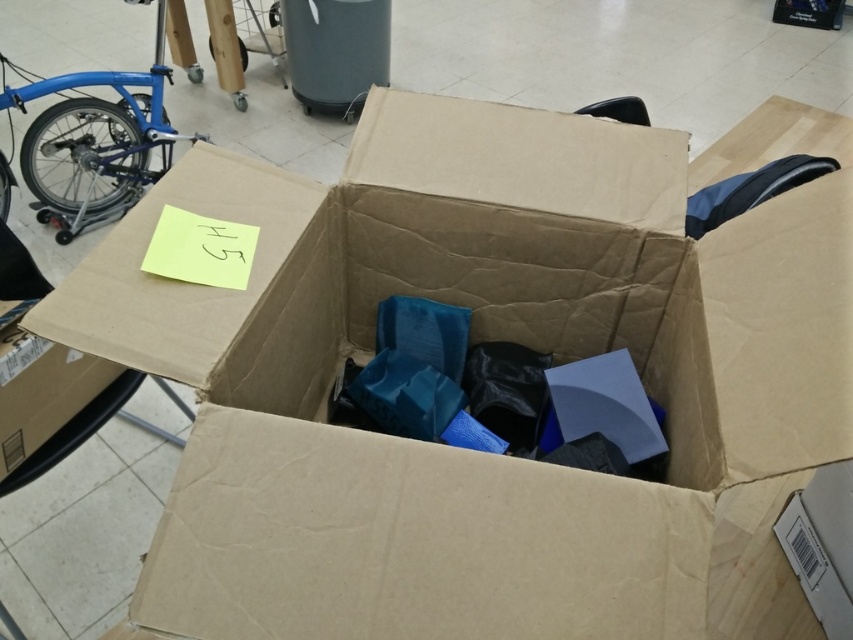
You are a GUI agent. You are given a task and a screenshot of the screen. Output one action in this format:
    pyautogui.click(x=<x>, y=<y>)
    Task: Click on the matte blue bicycle at left
    This screenshot has width=853, height=640.
    Given the screenshot: What is the action you would take?
    pyautogui.click(x=96, y=141)

Between point (106, 184) and point (55, 358), which one is positioned behind?

Positioned behind is point (106, 184).

You are a GUI agent. You are given a task and a screenshot of the screen. Output one action in this format:
    pyautogui.click(x=<x>, y=<y>)
    Task: Click on the matte blue bicycle at left
    This screenshot has width=853, height=640.
    Given the screenshot: What is the action you would take?
    pyautogui.click(x=96, y=141)